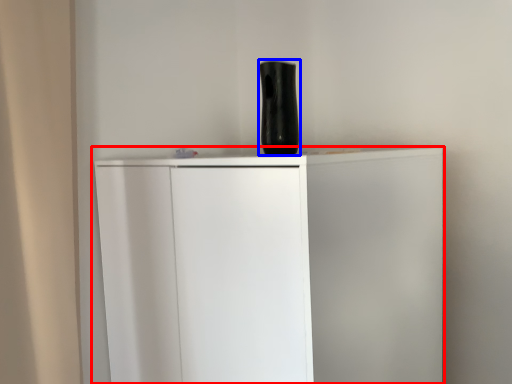
Question: Which point is further to the camera, cupboard (highlighted by a red box) or vase (highlighted by a blue box)?

Choices:
 (A) cupboard
 (B) vase

Answer: (B)